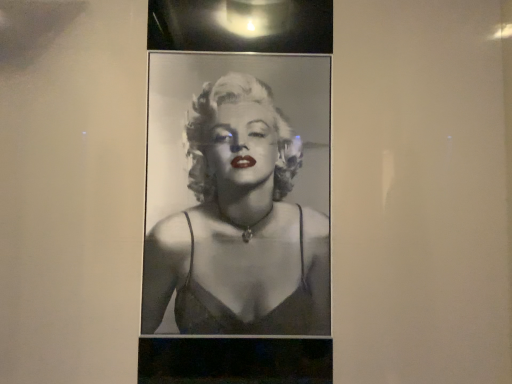
You are a GUI agent. You are given a task and a screenshot of the screen. Output one action in this format:
    pyautogui.click(x=<x>, y=<y>)
    Task: Click on the black glossy dress at center
    
    Given the screenshot: What is the action you would take?
    pyautogui.click(x=239, y=226)

Describe the element at coordinates (239, 226) in the screenshot. I see `black glossy dress at center` at that location.

Find the location of a particular element. This screenshot has height=384, width=512. black glossy dress at center is located at coordinates [239, 226].